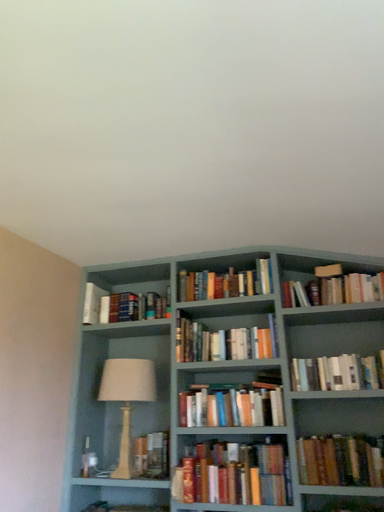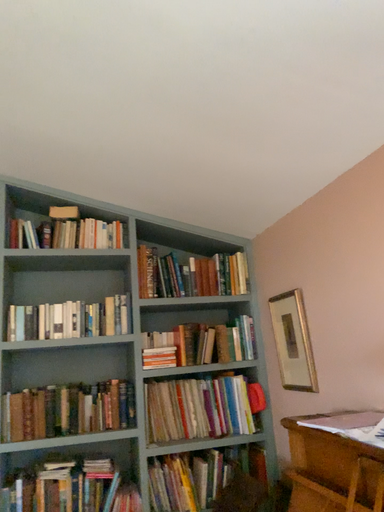
Question: How did the camera likely rotate when shooting the video?

Choices:
 (A) rotated downward
 (B) rotated upward

Answer: (A)